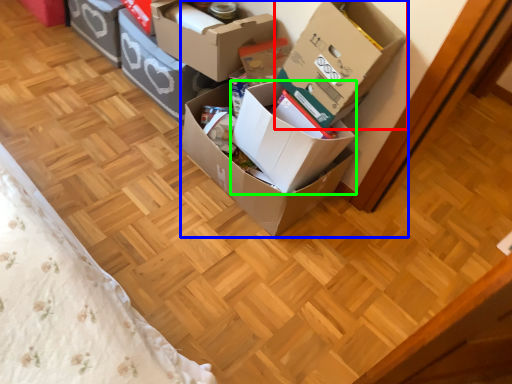
Question: Estimate the real-world distances between objects in this image. Which object is farther from box (highlighted by a red box), box (highlighted by a blue box) or box (highlighted by a green box)?

Choices:
 (A) box
 (B) box

Answer: (B)